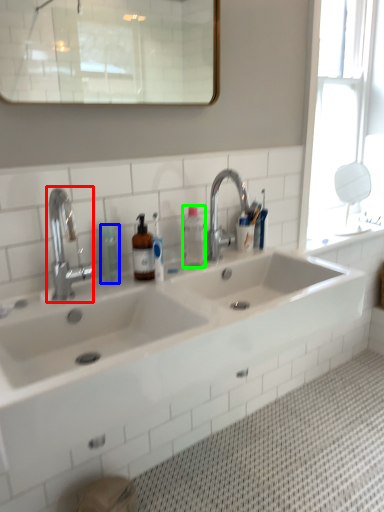
Question: Estimate the real-world distances between objects in this image. Which object is farther from tap (highlighted by a red box), toiletry (highlighted by a blue box) or bottle (highlighted by a green box)?

Choices:
 (A) toiletry
 (B) bottle

Answer: (B)